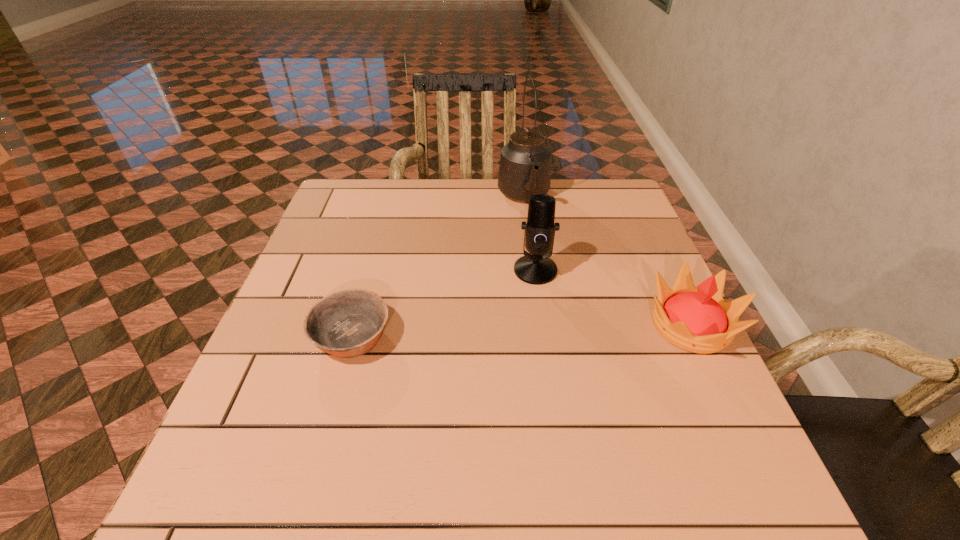
This screenshot has height=540, width=960. In order to click on vacant space situated 0.390m on the stand of the microphone in this screenshot , I will do `click(488, 431)`.

Locate an element on the screen. free location located on the stand of the microphone is located at coordinates (500, 389).

You are a GUI agent. You are given a task and a screenshot of the screen. Output one action in this format:
    pyautogui.click(x=<x>, y=<y>)
    Task: Click on the free space located on the stand of the microphone
    
    Given the screenshot: What is the action you would take?
    pyautogui.click(x=491, y=422)

Locate an element on the screen. The height and width of the screenshot is (540, 960). vacant space located spout on the tallest object is located at coordinates pos(540,249).

Where is `vacant space located 0.120m spout on the tallest object`? This screenshot has height=540, width=960. vacant space located 0.120m spout on the tallest object is located at coordinates (540, 244).

Where is `vacant space located spout on the tallest object`? vacant space located spout on the tallest object is located at coordinates (552, 280).

Where is `object that is at the far edge`? This screenshot has height=540, width=960. object that is at the far edge is located at coordinates (525, 162).

Where is `object that is at the left edge`? object that is at the left edge is located at coordinates [x=348, y=323].

I want to click on object present at the right edge, so click(x=697, y=319).

Locate an element on the screen. The image size is (960, 540). free spot at the far edge of the desktop is located at coordinates (400, 205).